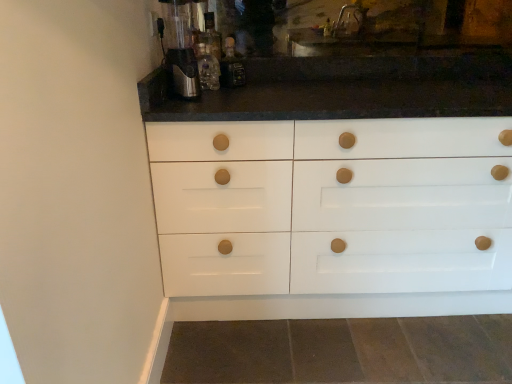
Question: Could you tell me if translucent glass bottle at upper center, positioned as the first bottle in left-to-right order, is turned towards satin silver coffee machine at upper left?

Choices:
 (A) yes
 (B) no

Answer: (B)

Question: Is satin silver coffee machine at upper left located within translucent glass bottle at upper center, positioned as the first bottle in left-to-right order?

Choices:
 (A) yes
 (B) no

Answer: (B)

Question: From a real-world perspective, is translucent glass bottle at upper center, the 2th bottle from the right, over satin silver coffee machine at upper left?

Choices:
 (A) yes
 (B) no

Answer: (B)

Question: Can you confirm if translucent glass bottle at upper center, positioned as the first bottle in left-to-right order, is shorter than satin silver coffee machine at upper left?

Choices:
 (A) yes
 (B) no

Answer: (A)

Question: Is translucent glass bottle at upper center, the 2th bottle from the right, not inside satin silver coffee machine at upper left?

Choices:
 (A) yes
 (B) no

Answer: (A)

Question: Is translucent glass bottle at upper center, positioned as the first bottle in left-to-right order, to the left or to the right of translucent glass bottle at center, which is counted as the first bottle, starting from the right, in the image?

Choices:
 (A) left
 (B) right

Answer: (A)

Question: Would you say translucent glass bottle at upper center, positioned as the first bottle in left-to-right order, is inside or outside translucent glass bottle at center, which is counted as the first bottle, starting from the right?

Choices:
 (A) outside
 (B) inside

Answer: (A)

Question: From the image's perspective, is translucent glass bottle at upper center, positioned as the first bottle in left-to-right order, located above or below translucent glass bottle at center, which ranks as the second bottle in left-to-right order?

Choices:
 (A) below
 (B) above

Answer: (A)

Question: Is point (218, 79) positioned closer to the camera than point (226, 79)?

Choices:
 (A) farther
 (B) closer

Answer: (A)

Question: In terms of width, does satin silver coffee machine at upper left look wider or thinner when compared to translucent glass bottle at center, which is counted as the first bottle, starting from the right?

Choices:
 (A) thin
 (B) wide

Answer: (B)

Question: Considering the positions of satin silver coffee machine at upper left and translucent glass bottle at center, which ranks as the second bottle in left-to-right order, in the image, is satin silver coffee machine at upper left taller or shorter than translucent glass bottle at center, which ranks as the second bottle in left-to-right order,?

Choices:
 (A) tall
 (B) short

Answer: (A)

Question: Relative to translucent glass bottle at center, which ranks as the second bottle in left-to-right order, is satin silver coffee machine at upper left in front or behind?

Choices:
 (A) behind
 (B) front

Answer: (B)

Question: Visually, is satin silver coffee machine at upper left positioned to the left or to the right of translucent glass bottle at center, which ranks as the second bottle in left-to-right order?

Choices:
 (A) left
 (B) right

Answer: (A)

Question: Considering the positions of satin silver coffee machine at upper left and translucent glass bottle at upper center, the 2th bottle from the right, in the image, is satin silver coffee machine at upper left bigger or smaller than translucent glass bottle at upper center, the 2th bottle from the right,?

Choices:
 (A) big
 (B) small

Answer: (A)

Question: Choose the correct answer: Is satin silver coffee machine at upper left inside translucent glass bottle at upper center, positioned as the first bottle in left-to-right order, or outside it?

Choices:
 (A) outside
 (B) inside

Answer: (A)